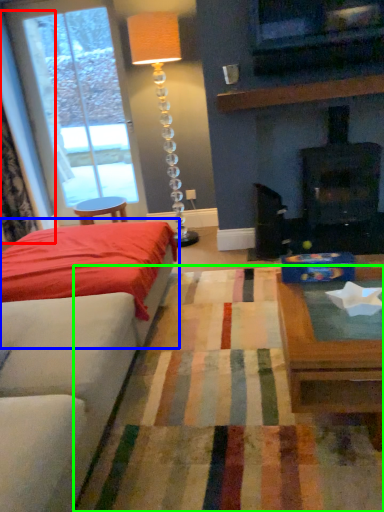
Question: Considering the real-world distances, which object is closest to curtain (highlighted by a red box)? bed (highlighted by a blue box) or plain (highlighted by a green box).

Choices:
 (A) bed
 (B) plain

Answer: (A)